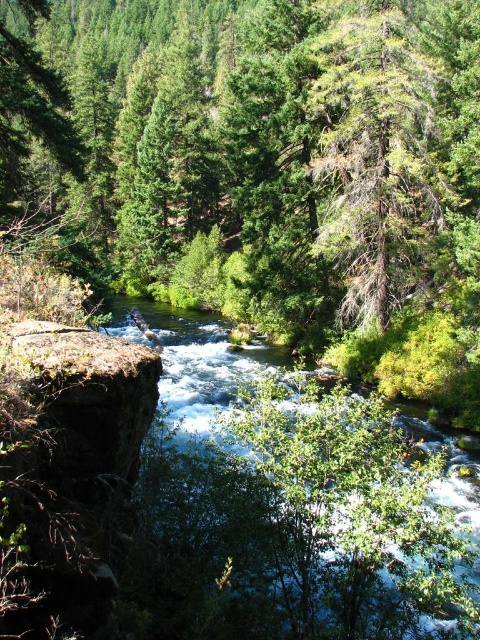
Is the position of clear water at center less distant than that of green textured tree at upper right?

Yes.

Does point (191, 449) lie in front of point (374, 13)?

Yes.

What do you see at coordinates (284, 513) in the screenshot? I see `clear water at center` at bounding box center [284, 513].

Identify the location of clear water at center. This screenshot has width=480, height=640. (284, 513).